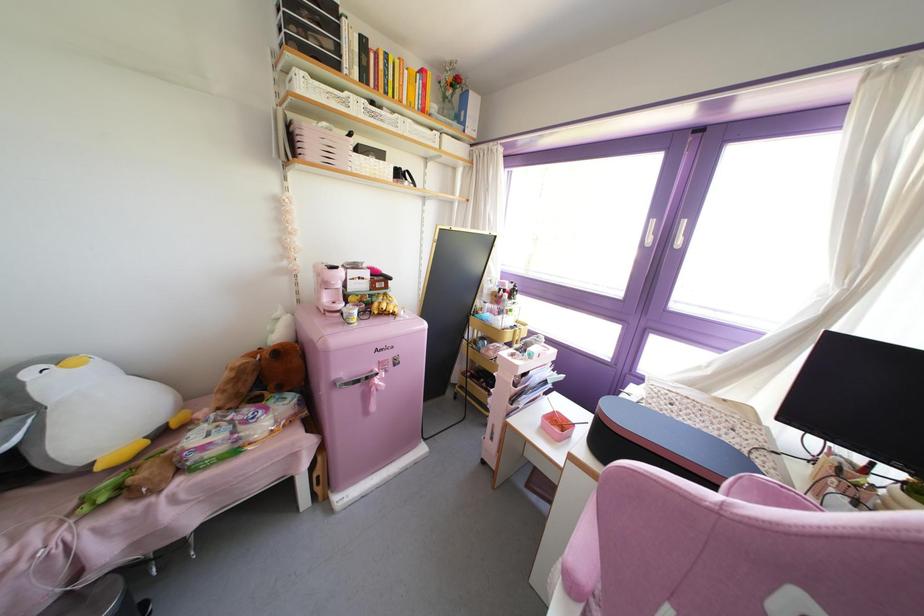
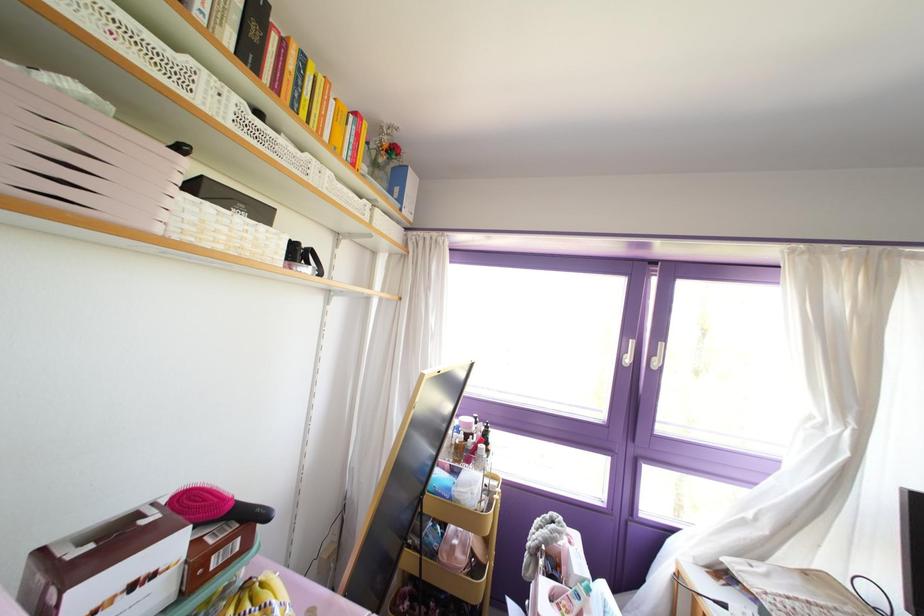
The point at (359,277) is marked in the first image. Where is the corresponding point in the second image?

(132, 586)